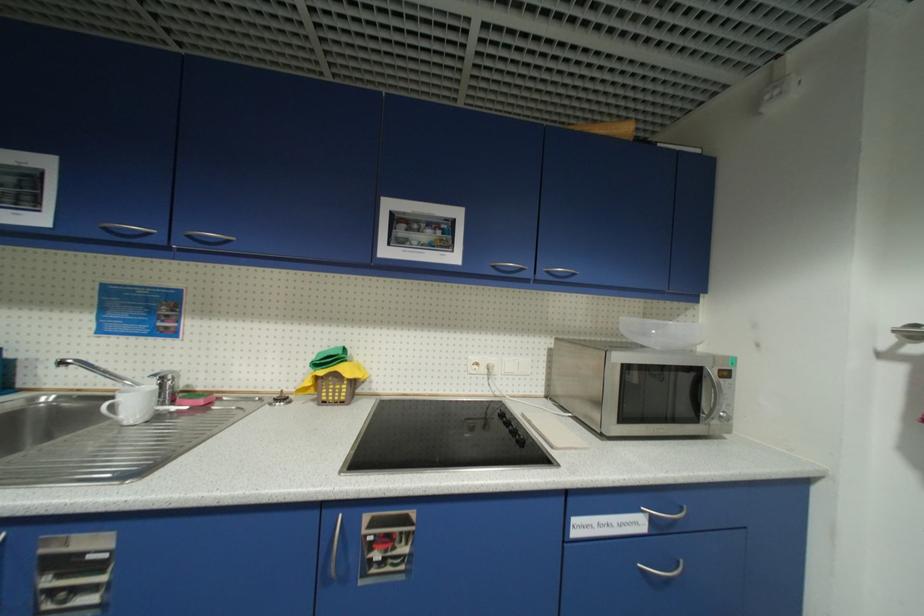
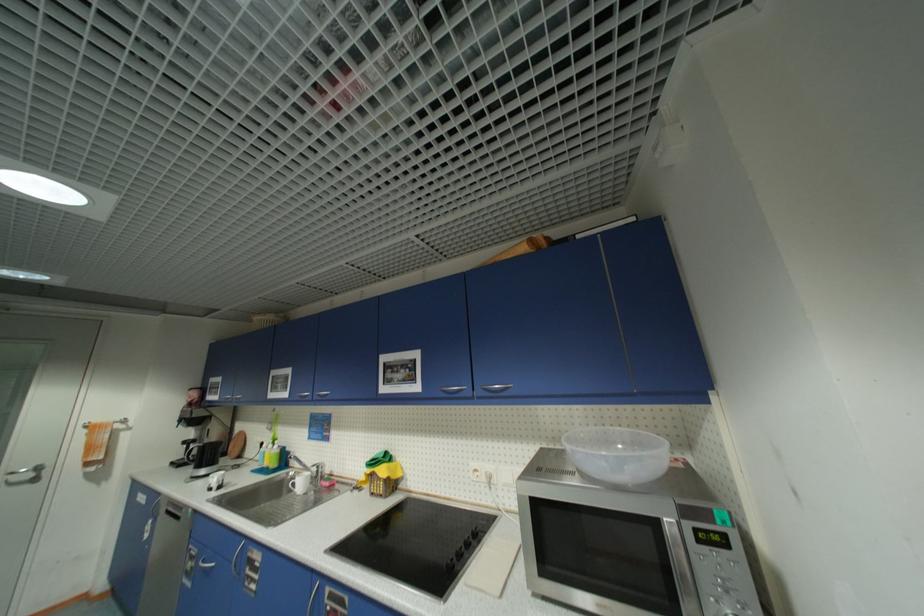
Locate, in the second image, the point that corresponds to point (40, 400) in the first image.

(294, 475)